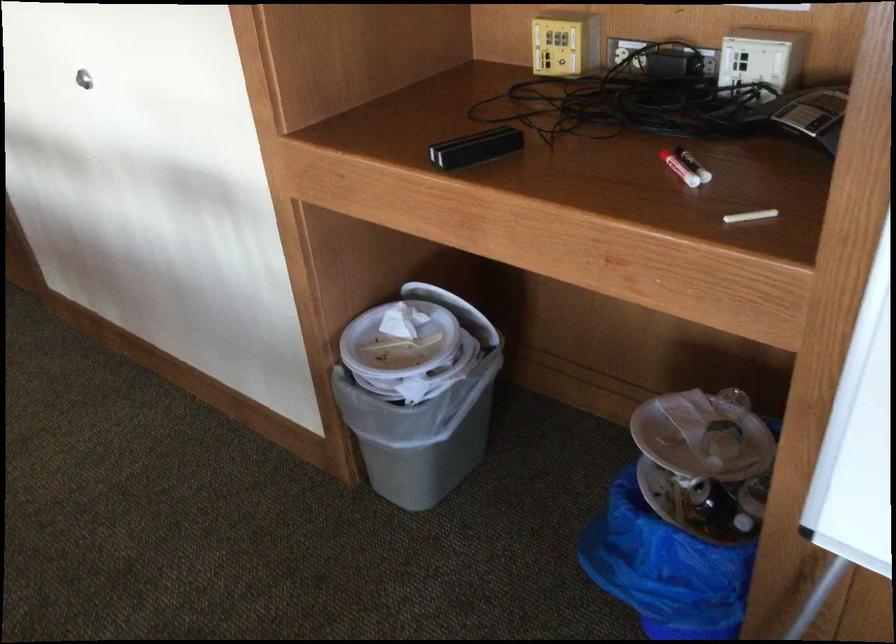
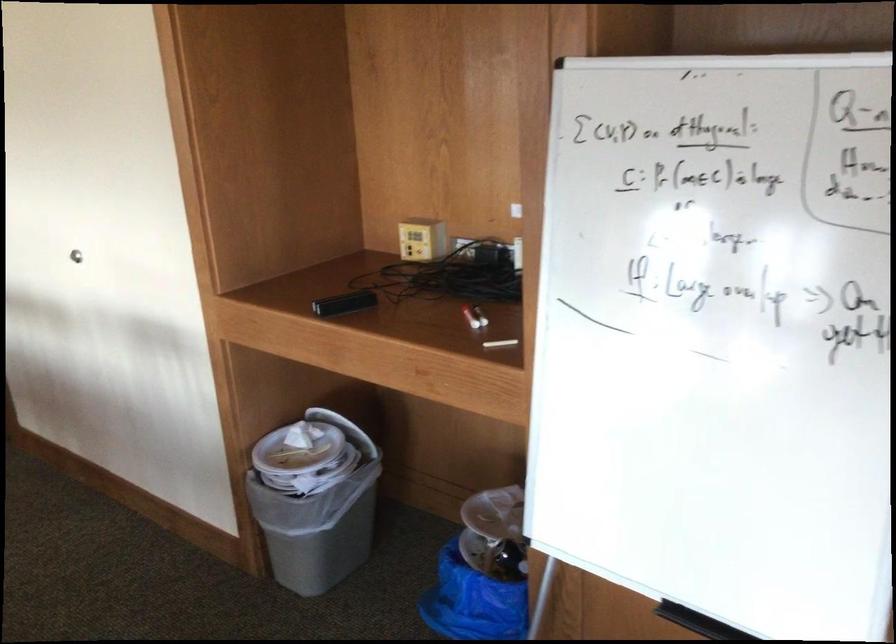
Find the pixel in the second image that matches point (677, 427) in the first image.

(495, 513)